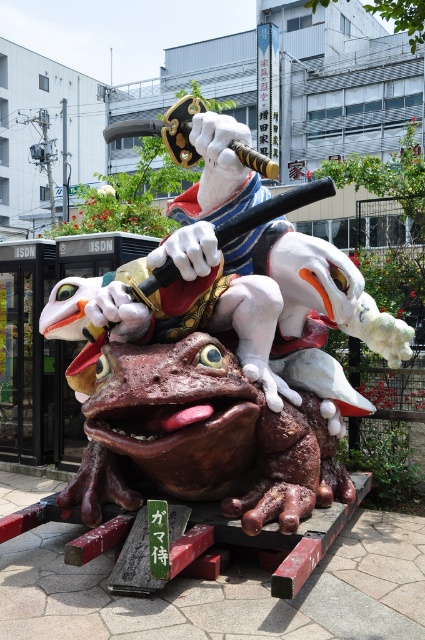
Does shiny metallic statue at center appear on the left side of shiny white octopus at center?

Correct, you'll find shiny metallic statue at center to the left of shiny white octopus at center.

Is shiny metallic statue at center taller than shiny white octopus at center?

Yes.

You are a GUI agent. You are given a task and a screenshot of the screen. Output one action in this format:
    pyautogui.click(x=<x>, y=<y>)
    Task: Click on the shiny metallic statue at center
    
    Given the screenshot: What is the action you would take?
    pyautogui.click(x=232, y=276)